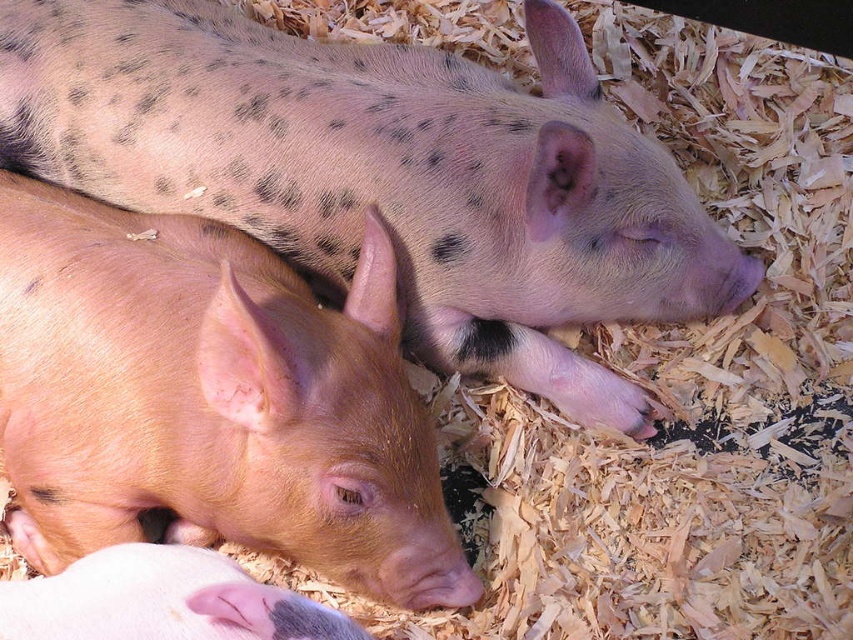
You are a farmer checking on your piglets. You notice the spotted pink pig at upper center and the pink smooth skin at lower left. Which piglet is larger in size?

The spotted pink pig at upper center is bigger than the pink smooth skin at lower left.

You are a farmer checking on the piglets in their pen. You notice the spotted pink pig at upper center and the pink smooth piglet at lower left. Which piglet is bigger?

The spotted pink pig at upper center is larger in size compared to the pink smooth piglet at lower left.

You are a farmer checking on your piglets in the pen. You notice two points marked in the image. The first point is at coordinate point (270, 161) and the second point is at coordinate point (183, 600). Which point is closer to you?

Point (270, 161) is further to the camera than point (183, 600), so the point closer to you is point (183, 600).